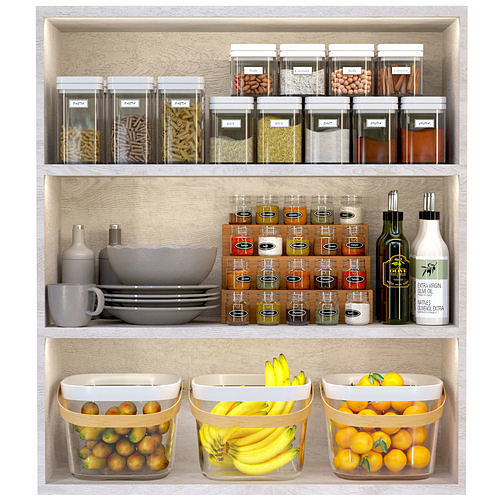
The height and width of the screenshot is (500, 500). In order to click on gray bowls in pantry in this screenshot , I will do `click(190, 315)`, `click(199, 303)`, `click(182, 299)`, `click(186, 293)`, `click(191, 266)`.